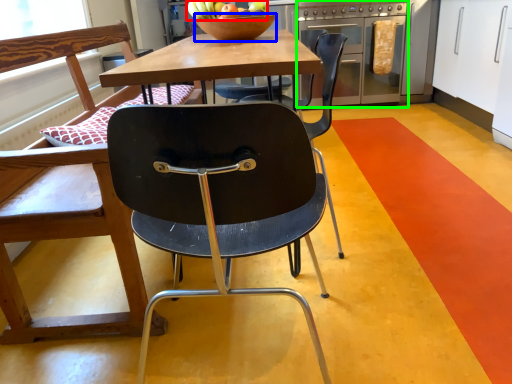
Question: Which object is positioned closest to fruit (highlighted by a red box)? Select from bowl (highlighted by a blue box) and oven (highlighted by a green box).

Choices:
 (A) bowl
 (B) oven

Answer: (A)